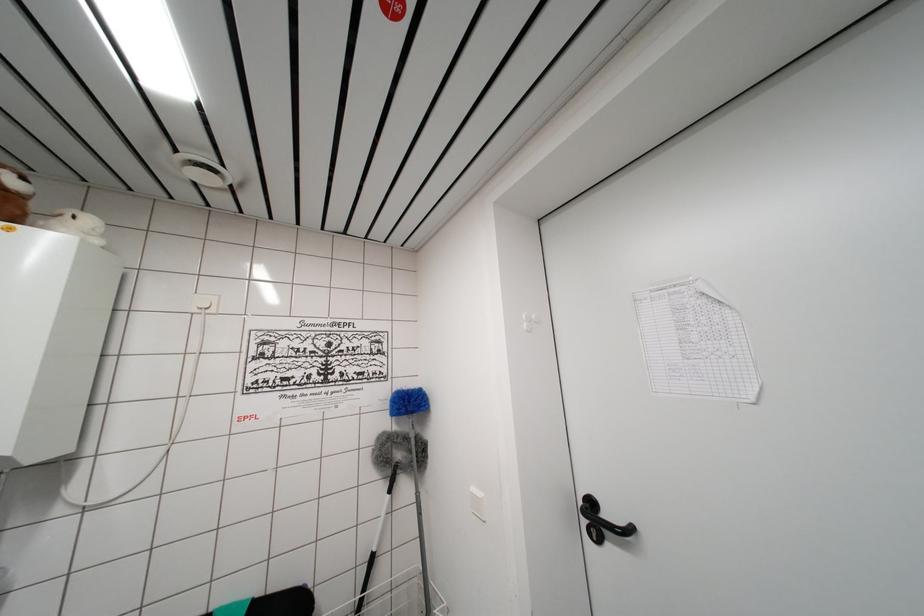
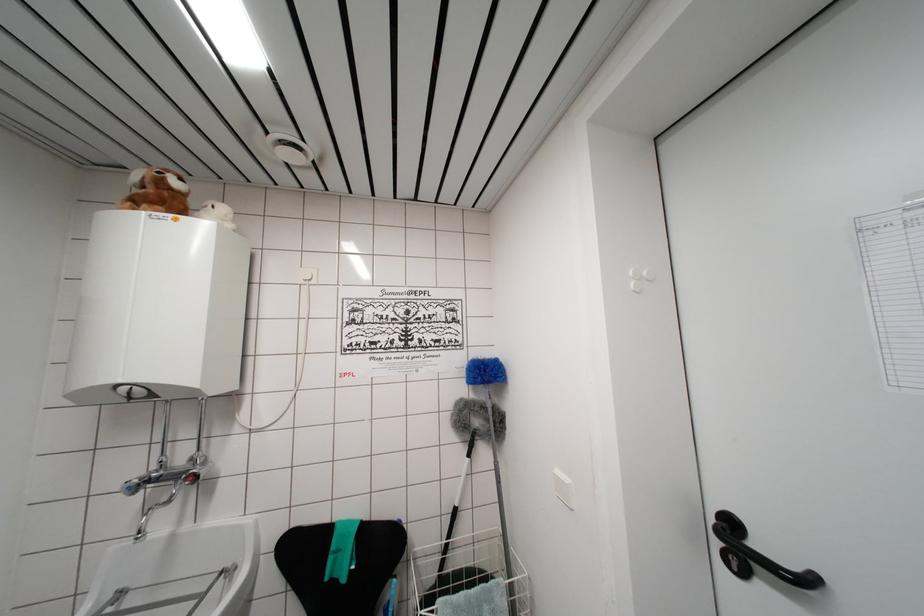
Where in the second image is the point corresponding to pixel 529 321 from the first image?

(637, 276)